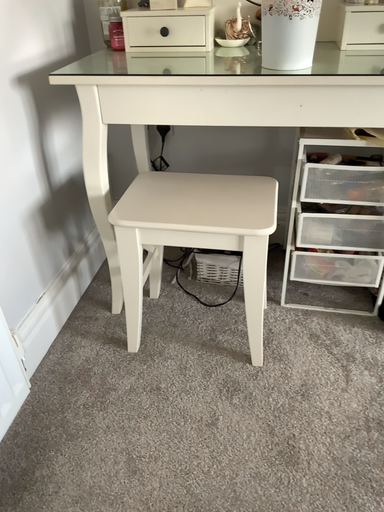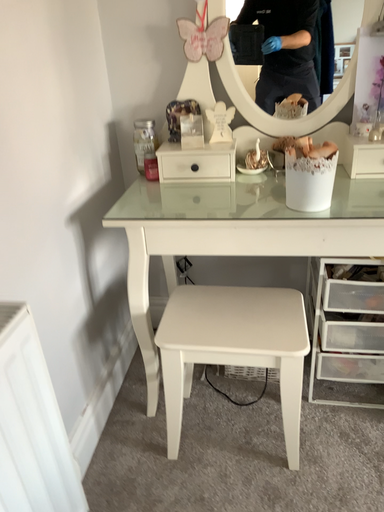
Question: Which way did the camera rotate in the video?

Choices:
 (A) rotated downward
 (B) rotated upward

Answer: (B)